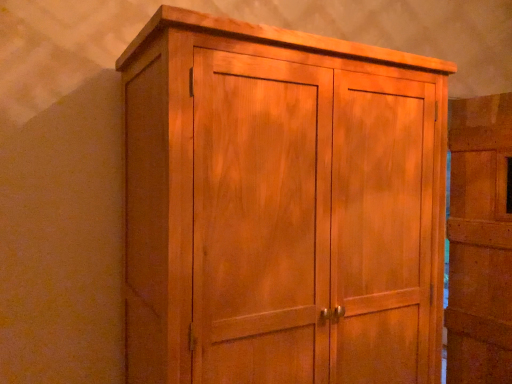
Question: Relative to light brown wood cupboard at center, is matte wood door at right in front or behind?

Choices:
 (A) front
 (B) behind

Answer: (B)

Question: Is point (446, 317) closer or farther from the camera than point (354, 198)?

Choices:
 (A) farther
 (B) closer

Answer: (A)

Question: Looking at the image, does matte wood door at right seem bigger or smaller compared to light brown wood cupboard at center?

Choices:
 (A) small
 (B) big

Answer: (A)

Question: Considering their positions, is light brown wood cupboard at center located in front of or behind matte wood door at right?

Choices:
 (A) behind
 (B) front

Answer: (B)

Question: Is light brown wood cupboard at center taller or shorter than matte wood door at right?

Choices:
 (A) short
 (B) tall

Answer: (A)

Question: Based on their sizes in the image, would you say light brown wood cupboard at center is bigger or smaller than matte wood door at right?

Choices:
 (A) big
 (B) small

Answer: (A)

Question: Which is correct: light brown wood cupboard at center is inside matte wood door at right, or outside of it?

Choices:
 (A) outside
 (B) inside

Answer: (A)